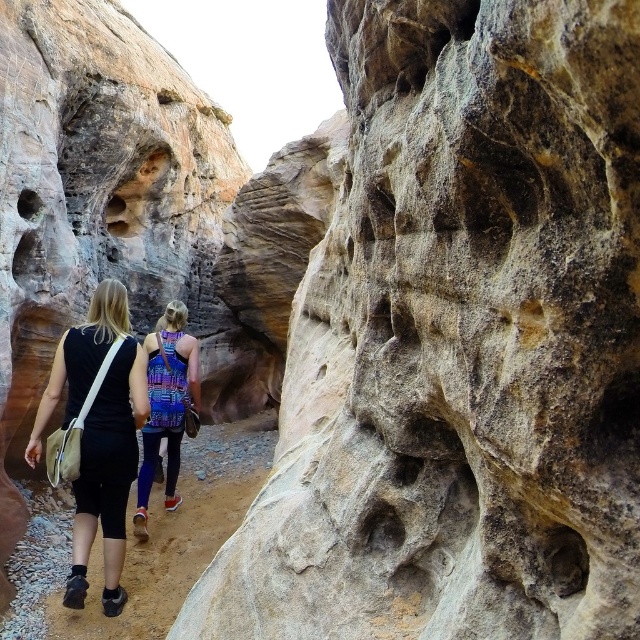
Question: Is black fabric bag at center below multicolored fabric backpack at center?

Choices:
 (A) yes
 (B) no

Answer: (A)

Question: Which point is closer to the camera?

Choices:
 (A) multicolored fabric backpack at center
 (B) black fabric bag at center

Answer: (B)

Question: Among these points, which one is nearest to the camera?

Choices:
 (A) (104, 301)
 (B) (182, 422)

Answer: (A)

Question: Considering the relative positions of black fabric bag at center and multicolored fabric backpack at center in the image provided, where is black fabric bag at center located with respect to multicolored fabric backpack at center?

Choices:
 (A) below
 (B) above

Answer: (A)

Question: Observing the image, what is the correct spatial positioning of black fabric bag at center in reference to multicolored fabric backpack at center?

Choices:
 (A) above
 (B) below

Answer: (B)